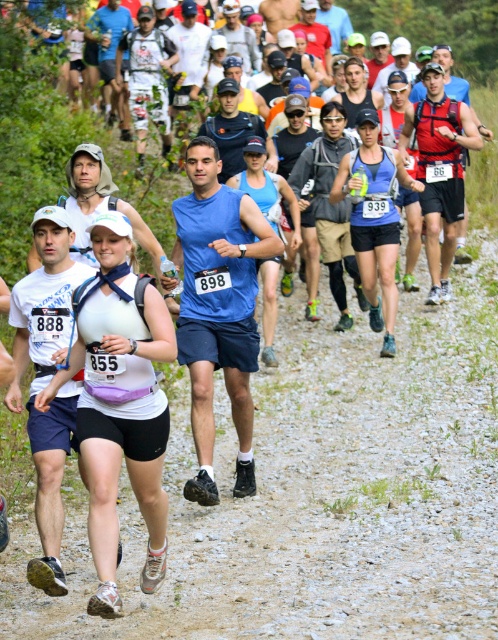
You are a photographer positioned at the starting line of the trail running event. You want to capture a photo of both the white fabric runner at center and the blue fabric tank top at center in the same frame. Given that your camera has a minimum focus distance of 1.5 meters, will you be able to take this photo?

The white fabric runner at center and blue fabric tank top at center are 2.08 meters apart from each other. Since the minimum focus distance is 1.5 meters, the photographer can capture both in the same frame as the distance between them exceeds the minimum requirement.

You are a photographer at the trail running event and want to capture both the white matte tank top at center and the blue fabric tank top at center in a single frame. Which runner should you focus on first to ensure both are in the shot?

You should focus on the blue fabric tank top at center first because it is larger and will be easier to frame, ensuring the smaller white matte tank top at center is also captured in the shot.

You are a photographer at the trail running event and want to capture a photo of both the white matte tank top at center and the blue fabric tank top at center. Which runner should you focus on first to ensure both are in the frame?

The white matte tank top at center is positioned on the left side of blue fabric tank top at center, so you should focus on the white matte tank top at center first to ensure both are in the frame.